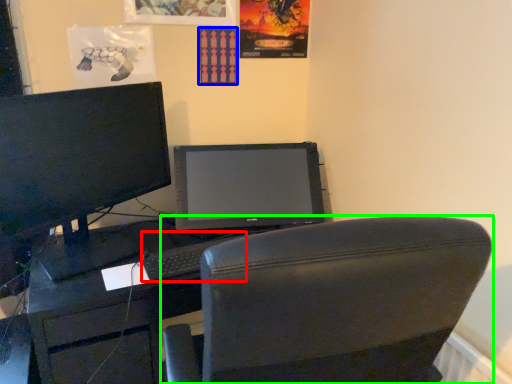
Question: Based on their relative distances, which object is nearer to keyboard (highlighted by a red box)? Choose from poster page (highlighted by a blue box) and chair (highlighted by a green box).

Choices:
 (A) poster page
 (B) chair

Answer: (B)